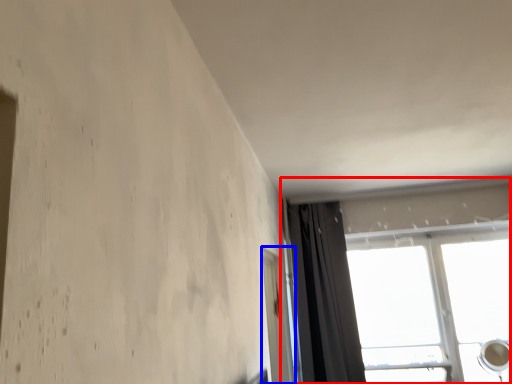
Question: Which of the following is the closest to the observer, window (highlighted by a red box) or screen door (highlighted by a blue box)?

Choices:
 (A) window
 (B) screen door

Answer: (B)